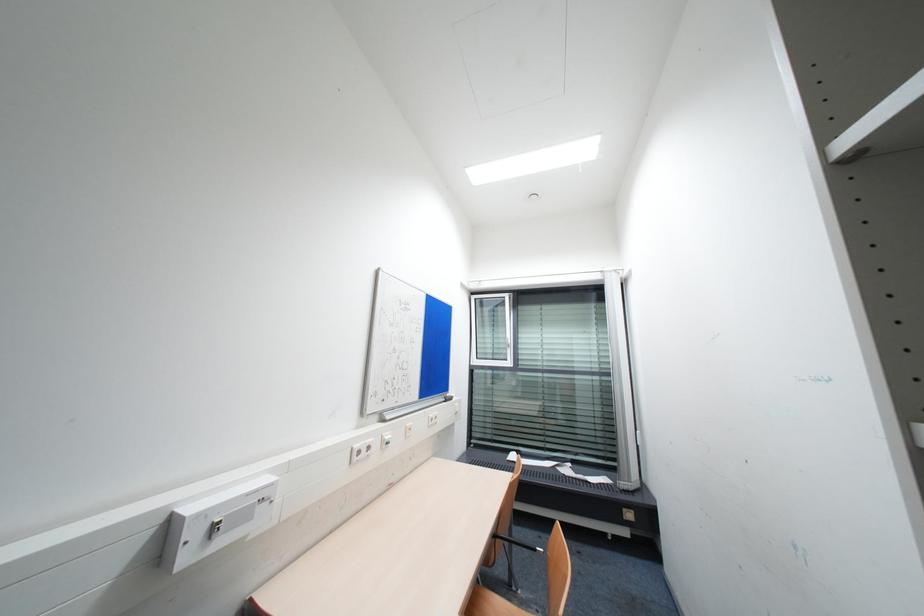
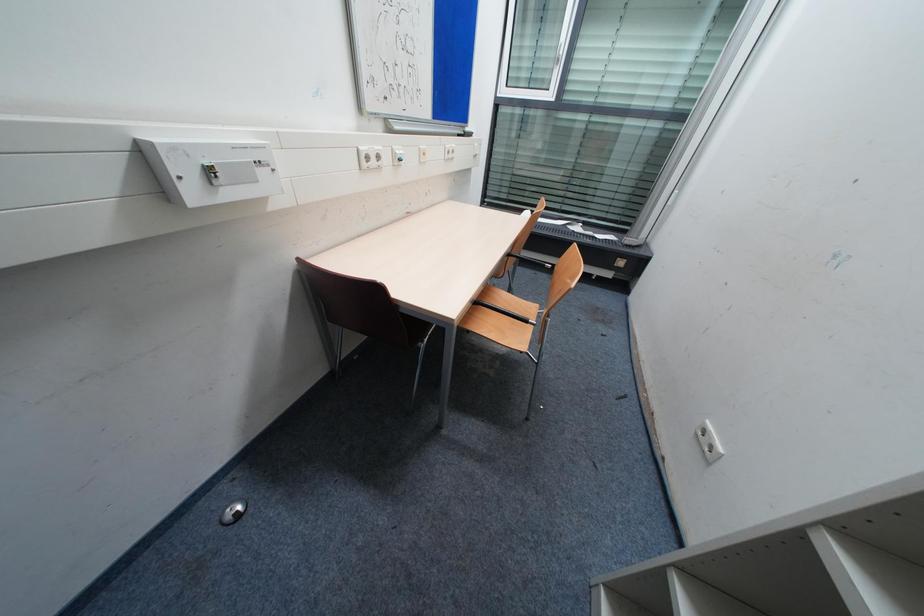
Question: How did the camera likely rotate?

Choices:
 (A) Left
 (B) Right
 (C) Up
 (D) Down

Answer: (D)